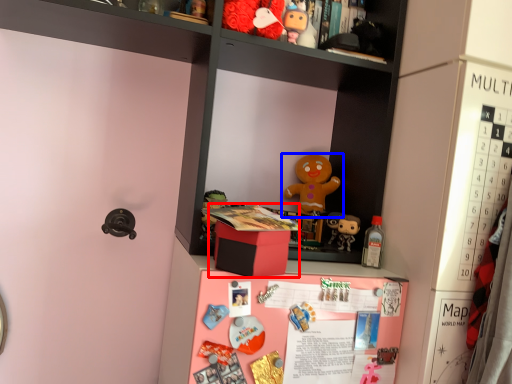
Question: Which point is further to the camera, box (highlighted by a red box) or toy (highlighted by a blue box)?

Choices:
 (A) box
 (B) toy

Answer: (B)